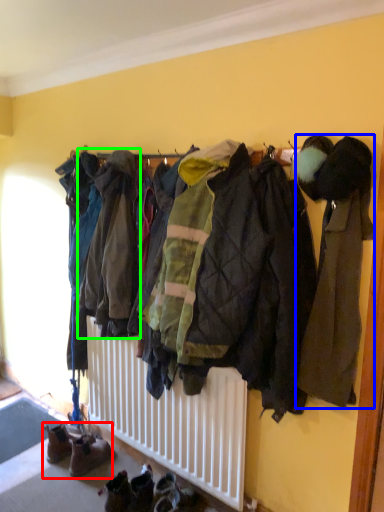
Question: Which object is positioned closest to footwear (highlighted by a red box)? Select from jacket (highlighted by a blue box) and jacket (highlighted by a green box).

Choices:
 (A) jacket
 (B) jacket

Answer: (B)